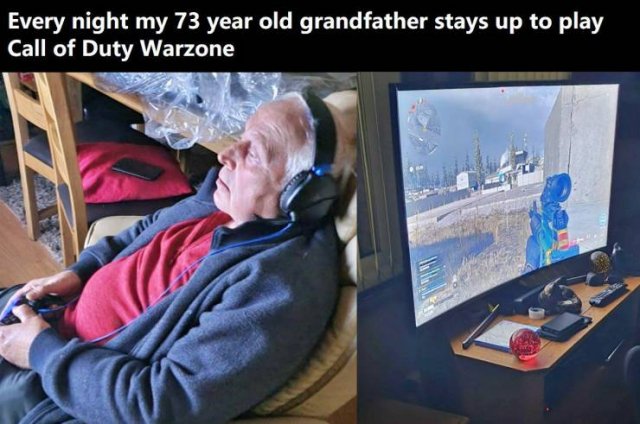
What are the coordinates of `video game controller` in the screenshot? It's located at (16, 301).